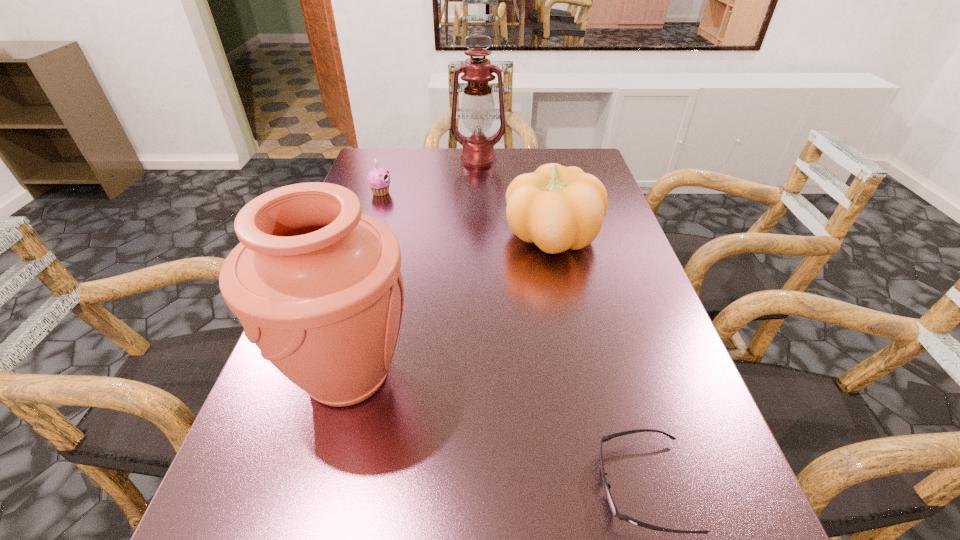
The width and height of the screenshot is (960, 540). What are the coordinates of `the farthest object` in the screenshot? It's located at (478, 108).

This screenshot has width=960, height=540. I want to click on vase, so click(317, 285).

I want to click on the third shortest object, so click(x=558, y=208).

This screenshot has height=540, width=960. I want to click on pumpkin, so click(x=558, y=208).

Identify the location of the fourth tallest object. (378, 179).

Locate an element on the screen. The width and height of the screenshot is (960, 540). cupcake is located at coordinates (378, 179).

Where is `vacant region located on the right of the oil lamp`? The width and height of the screenshot is (960, 540). vacant region located on the right of the oil lamp is located at coordinates (589, 160).

Identify the location of vacant space located 0.240m on the right of the vase. (552, 375).

Find the location of a particular element. This screenshot has height=540, width=960. free space located 0.060m on the front of the pumpkin is located at coordinates (563, 287).

You are a GUI agent. You are given a task and a screenshot of the screen. Output one action in this format:
    pyautogui.click(x=<x>, y=<y>)
    Task: Click on the blank space located 0.250m on the face of the cupcake
    The image size is (960, 540).
    Given the screenshot: What is the action you would take?
    pyautogui.click(x=479, y=192)